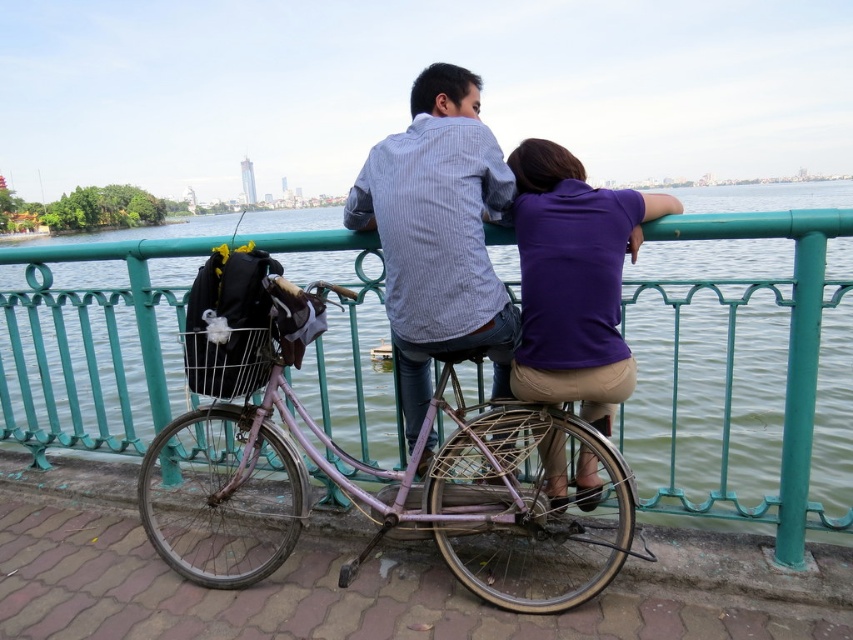
Which is more to the right, purple matte bicycle at center or striped cotton shirt at center?

striped cotton shirt at center is more to the right.

Which is more to the left, purple matte bicycle at center or striped cotton shirt at center?

Positioned to the left is purple matte bicycle at center.

This screenshot has height=640, width=853. What are the coordinates of `purple matte bicycle at center` in the screenshot? It's located at (375, 476).

Which of these two, green metal railing at upper center or purple matte shirt at upper right, stands taller?

green metal railing at upper center is taller.

Does point (677, 483) come in front of point (541, 397)?

No, it is behind (541, 397).

Image resolution: width=853 pixels, height=640 pixels. Identify the location of green metal railing at upper center. (743, 355).

Is striped cotton shirt at center bigger than purple matte shirt at upper right?

No.

Does point (494, 216) lie behind point (598, 396)?

Yes, it is.

Based on the photo, measure the distance between striped cotton shirt at center and camera.

striped cotton shirt at center and camera are 2.17 meters apart from each other.

Where is `striped cotton shirt at center`? Image resolution: width=853 pixels, height=640 pixels. striped cotton shirt at center is located at coordinates (438, 234).